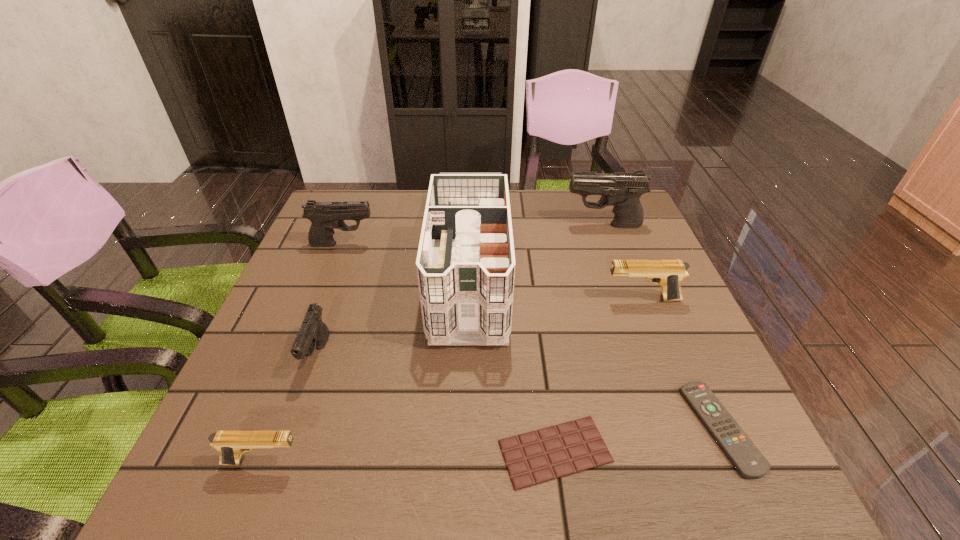
This screenshot has width=960, height=540. I want to click on vacant area located at the barrel of the bigger tan pistol, so click(480, 299).

Where is `free space located at the barrel of the bigger tan pistol`? free space located at the barrel of the bigger tan pistol is located at coordinates coord(561,299).

You are a GUI agent. You are given a task and a screenshot of the screen. Output one action in this format:
    pyautogui.click(x=<x>, y=<y>)
    Task: Click on the free space located 0.060m at the barrel of the second nearest pistol
    This screenshot has height=540, width=960.
    Given the screenshot: What is the action you would take?
    pyautogui.click(x=300, y=409)

The height and width of the screenshot is (540, 960). I want to click on vacant position located at the barrel of the nearer tan pistol, so click(x=380, y=462).

Where is `free space located 0.330m on the left of the second shortest object`? The image size is (960, 540). free space located 0.330m on the left of the second shortest object is located at coordinates (509, 428).

Where is `vacant space located 0.260m on the back of the brown chocolate bar`? Image resolution: width=960 pixels, height=540 pixels. vacant space located 0.260m on the back of the brown chocolate bar is located at coordinates (537, 315).

Where is `dollhouse that is at the far edge`? The width and height of the screenshot is (960, 540). dollhouse that is at the far edge is located at coordinates pyautogui.click(x=465, y=264).

At what (x,y) coordinates should I click in order to perform the action: click on pistol located in the far edge section of the desktop. Please return your answer as a coordinate pair (x, y). Image resolution: width=960 pixels, height=540 pixels. Looking at the image, I should click on (x=622, y=190).

The height and width of the screenshot is (540, 960). I want to click on pistol at the near edge, so tap(231, 444).

I want to click on remote control that is positioned at the near edge, so click(750, 463).